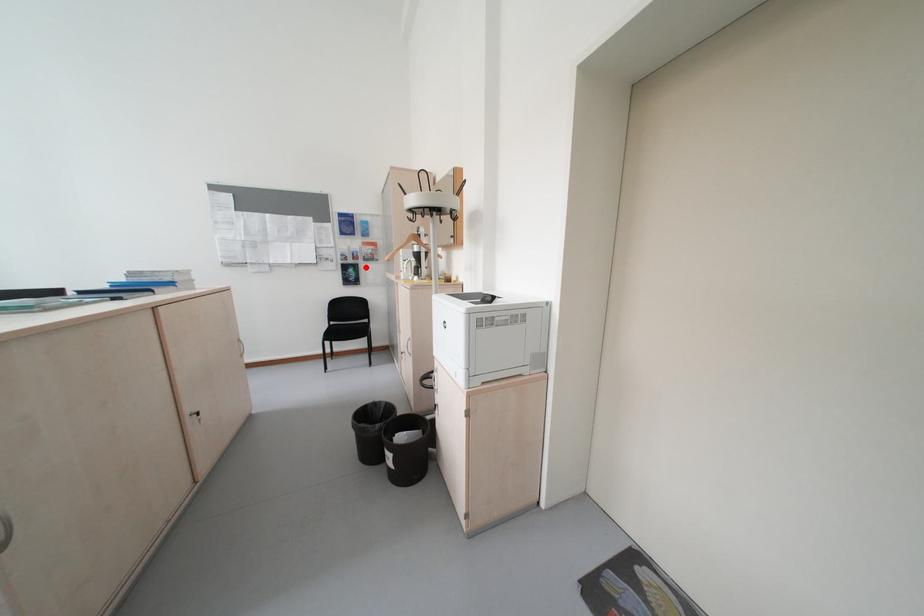
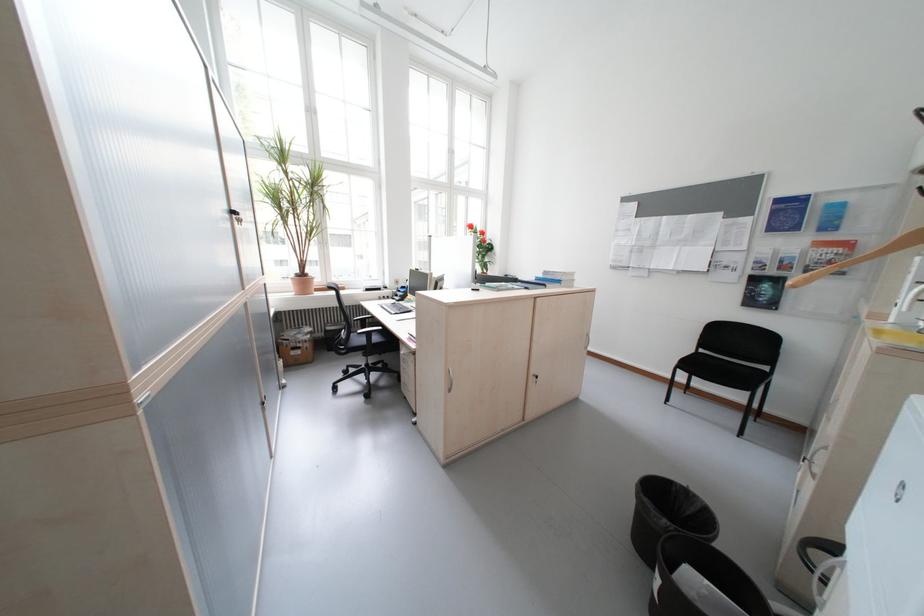
Locate, in the second image, the point that corresponds to the highlighted location in the first image.

(788, 282)